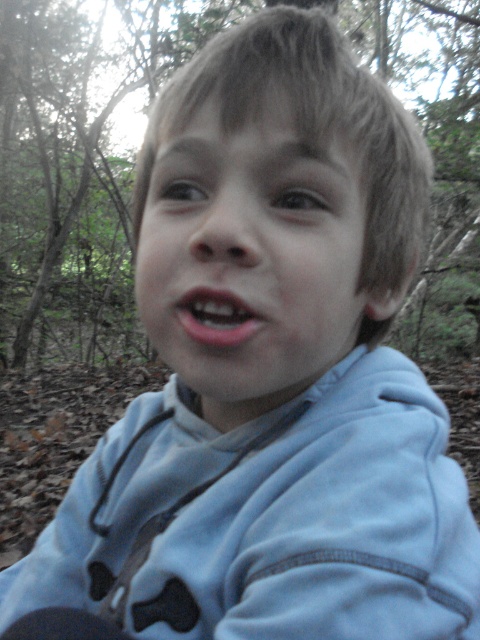
Question: Considering the relative positions of light blue fleece jacket at center and pink matte lips at center in the image provided, where is light blue fleece jacket at center located with respect to pink matte lips at center?

Choices:
 (A) left
 (B) right

Answer: (A)

Question: Is light blue fleece jacket at center positioned behind pink matte lips at center?

Choices:
 (A) no
 (B) yes

Answer: (A)

Question: Which is farther from the smooth skin face at center?

Choices:
 (A) pink matte lips at center
 (B) light blue fleece jacket at center

Answer: (B)

Question: Which object appears closest to the camera in this image?

Choices:
 (A) smooth skin face at center
 (B) light blue fleece jacket at center

Answer: (B)

Question: Is light blue fleece jacket at center to the left of pink matte lips at center from the viewer's perspective?

Choices:
 (A) no
 (B) yes

Answer: (B)

Question: Which point is closer to the camera?

Choices:
 (A) (232, 308)
 (B) (248, 134)

Answer: (A)